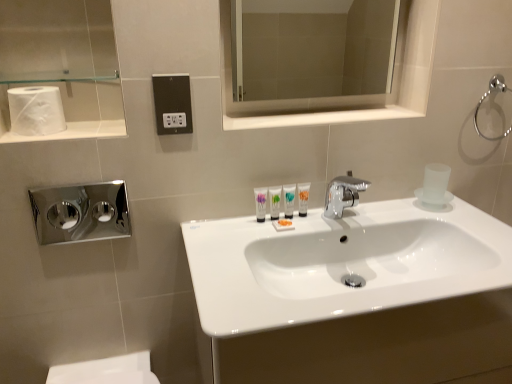
Locate an element on the screen. The height and width of the screenshot is (384, 512). unoccupied region to the right of polished chrome faucet at center is located at coordinates (401, 220).